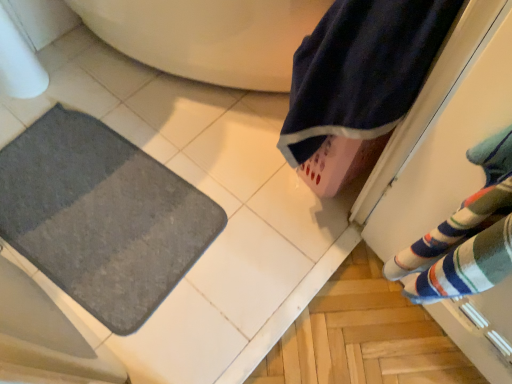
The image size is (512, 384). In order to click on free space to the back side of gray soft mat at lower left in this screenshot , I will do `click(130, 100)`.